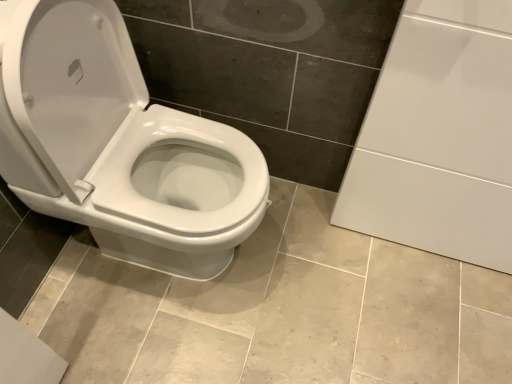
Describe the element at coordinates (118, 144) in the screenshot. This screenshot has width=512, height=384. I see `white glossy toilet at left` at that location.

At what (x,y) coordinates should I click in order to perform the action: click on white glossy toilet at left. Please return your answer as a coordinate pair (x, y). Looking at the image, I should click on (118, 144).

The width and height of the screenshot is (512, 384). I want to click on white glossy toilet at left, so click(x=118, y=144).